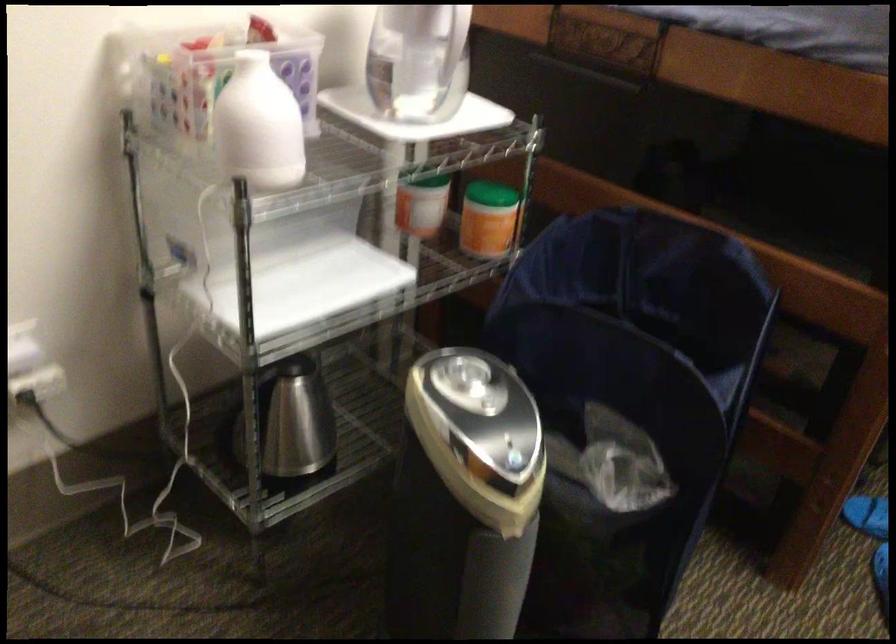
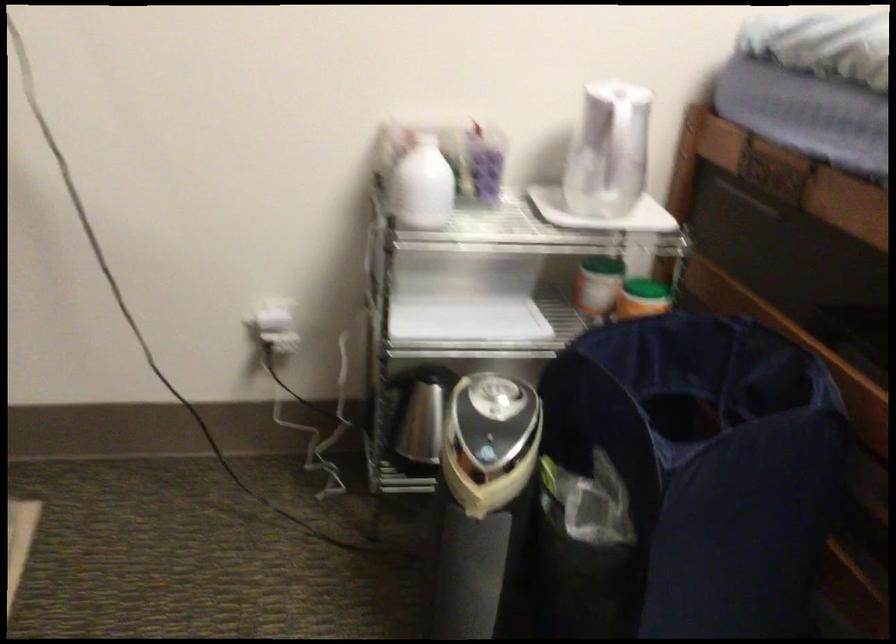
Where in the second image is the point corresponding to [501,205] from the first image?

(642, 298)